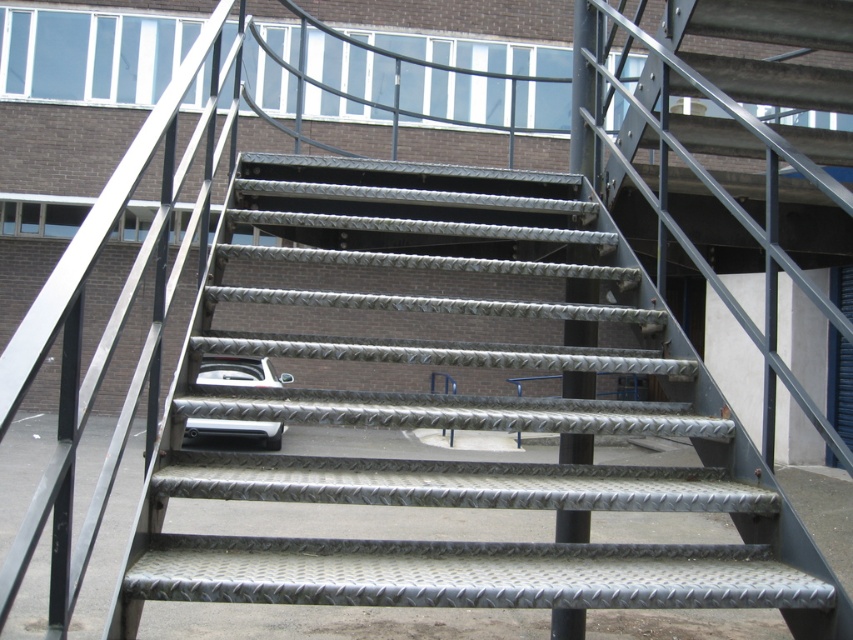
You are a delivery person with a cart that is 1.2 meters wide. You need to navigate between the metallic textured stairs at center and the metallic silver car at center. Can your cart fit through the space between them?

The metallic textured stairs at center might be wider than metallic silver car at center, so the space between them could be sufficient for the cart. However, since the exact width difference isn not specified, it is uncertain whether the 1.2 meter wide cart will fit. Further measurement is needed to confirm.

You are standing in front of the industrial stairs and want to reach the point marked at coordinate (717, 426). The stairs have a maximum safe distance of 3 meters from the viewer for comfortable climbing. Can you safely reach that point without exceeding the distance limit?

The point at (717, 426) is 3.12 meters from the viewer, which exceeds the maximum safe distance of 3 meters. Therefore, reaching that point may not be safe.

You are a delivery person trying to park your metallic silver car at center near the entrance. The entrance is located under the metallic textured stairs at center. Can you park your car there without blocking the stairs?

The metallic textured stairs at center is bigger than the metallic silver car at center, so there might be enough space to park the car without blocking the stairs.